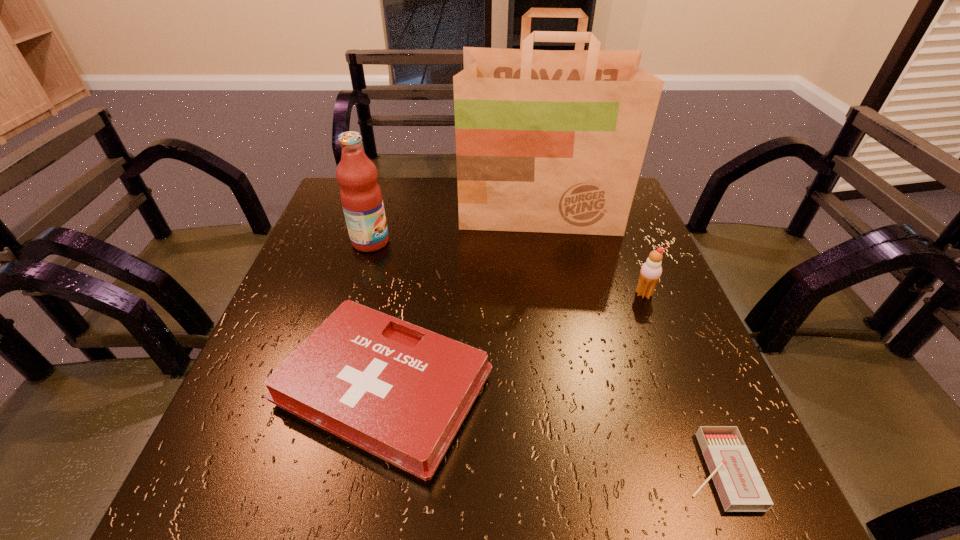
I want to click on vacant space located 0.350m on the striking surface of the shortest object, so click(452, 470).

Identify the location of vacant space located 0.070m on the striking surface of the shortest object. (636, 470).

Locate an element on the screen. This screenshot has height=540, width=960. vacant region located 0.060m on the striking surface of the shortest object is located at coordinates (643, 470).

Where is `object that is at the far edge`? object that is at the far edge is located at coordinates (547, 141).

This screenshot has width=960, height=540. What are the coordinates of `the first-aid kit that is at the near edge` in the screenshot? It's located at (401, 392).

Find the location of a particular element. matchbox that is at the near edge is located at coordinates (740, 487).

What are the coordinates of `fruit juice located in the left edge section of the desktop` in the screenshot? It's located at (361, 197).

Find the location of a particular element. This screenshot has width=960, height=540. the first-aid kit located in the left edge section of the desktop is located at coordinates (401, 392).

Find the location of a particular element. The width and height of the screenshot is (960, 540). grocery bag that is at the right edge is located at coordinates (547, 141).

Find the location of `icecream that is at the right edge`. icecream that is at the right edge is located at coordinates (651, 270).